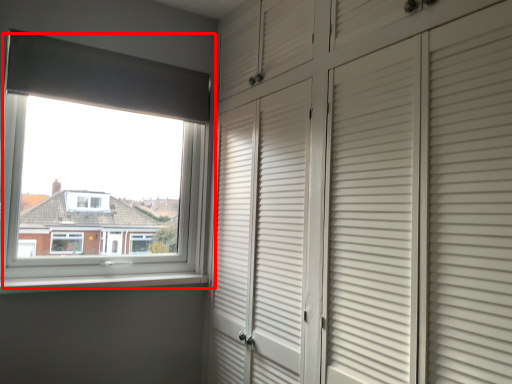
Question: From the image, what is the correct spatial relationship of window (annotated by the red box) in relation to window sill?

Choices:
 (A) right
 (B) left

Answer: (B)